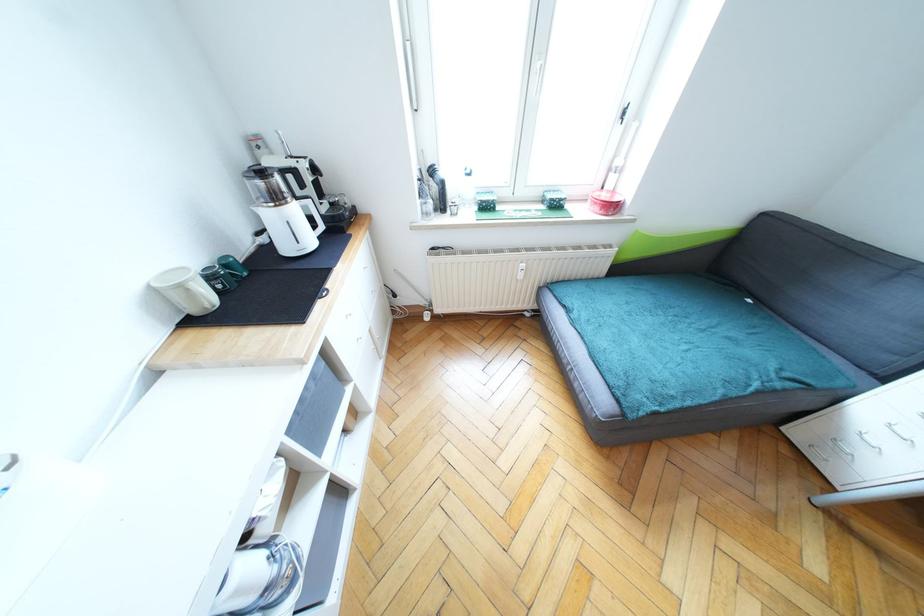
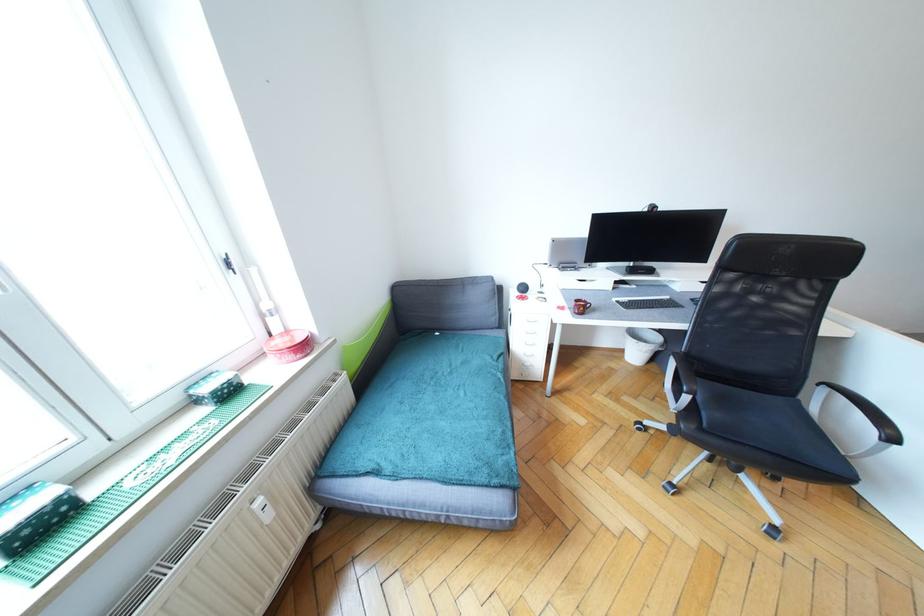
Question: The images are taken continuously from a first-person perspective. In which direction is your viewpoint rotating?

Choices:
 (A) Left
 (B) Right
 (C) Up
 (D) Down

Answer: (B)